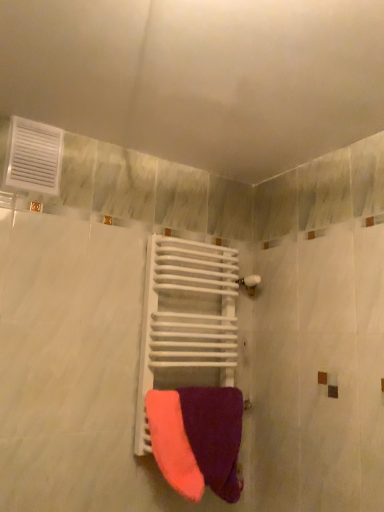
Question: Is white matte towel rack at center behind white plastic vent at upper left?

Choices:
 (A) no
 (B) yes

Answer: (B)

Question: Can you see white matte towel rack at center touching white plastic vent at upper left?

Choices:
 (A) yes
 (B) no

Answer: (B)

Question: Is white matte towel rack at center completely or partially outside of white plastic vent at upper left?

Choices:
 (A) yes
 (B) no

Answer: (A)

Question: Is white matte towel rack at center far away from white plastic vent at upper left?

Choices:
 (A) yes
 (B) no

Answer: (B)

Question: From a real-world perspective, is white matte towel rack at center positioned under white plastic vent at upper left based on gravity?

Choices:
 (A) yes
 (B) no

Answer: (A)

Question: Is point (x=162, y=396) closer or farther from the camera than point (x=155, y=371)?

Choices:
 (A) farther
 (B) closer

Answer: (B)

Question: Choose the correct answer: Is purple soft towel at center inside white matte towel rack at center or outside it?

Choices:
 (A) outside
 (B) inside

Answer: (A)

Question: Considering their positions, is purple soft towel at center located in front of or behind white matte towel rack at center?

Choices:
 (A) front
 (B) behind

Answer: (A)

Question: In terms of width, does purple soft towel at center look wider or thinner when compared to white matte towel rack at center?

Choices:
 (A) wide
 (B) thin

Answer: (B)

Question: From a real-world perspective, relative to white plastic vent at upper left, is white matte towel rack at center vertically above or below?

Choices:
 (A) below
 (B) above

Answer: (A)

Question: From their relative heights in the image, would you say white matte towel rack at center is taller or shorter than white plastic vent at upper left?

Choices:
 (A) short
 (B) tall

Answer: (B)

Question: Is white matte towel rack at center situated inside white plastic vent at upper left or outside?

Choices:
 (A) inside
 (B) outside

Answer: (B)

Question: Is point (190, 276) closer or farther from the camera than point (28, 124)?

Choices:
 (A) closer
 (B) farther

Answer: (B)

Question: Is point (218, 318) closer or farther from the camera than point (187, 462)?

Choices:
 (A) closer
 (B) farther

Answer: (B)

Question: Considering their positions, is white matte towel rack at center located in front of or behind purple soft towel at center?

Choices:
 (A) behind
 (B) front

Answer: (A)